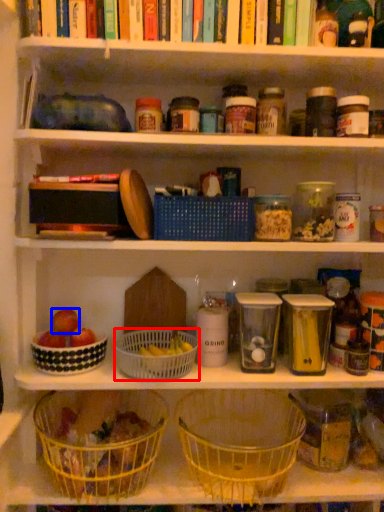
Question: Among these objects, which one is nearest to the camera, basket (highlighted by a red box) or apple (highlighted by a blue box)?

Choices:
 (A) basket
 (B) apple

Answer: (A)